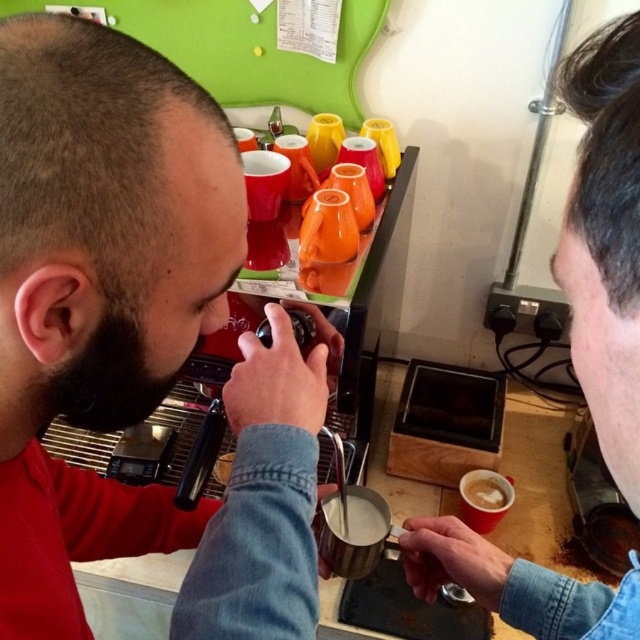
You are a barista trying to clean the counter. You need to move the black beard at left and the white frothy coffee at lower right. Which object should you move first to reach the other one?

The black beard at left is located above the white frothy coffee at lower right. To access the white frothy coffee at lower right, you should move the black beard at left first.

You are a barista trying to reach a point that is exactly at coordinate point (604, 435) in the image. The point is 13.81 inches away from you. Can you estimate whether this point is within your arm reach if your arm can extend up to 14 inches?

The point at coordinate point (604, 435) is 13.81 inches away from you, which is within your arm reach since your arm can extend up to 14 inches. Yes, you can reach it.